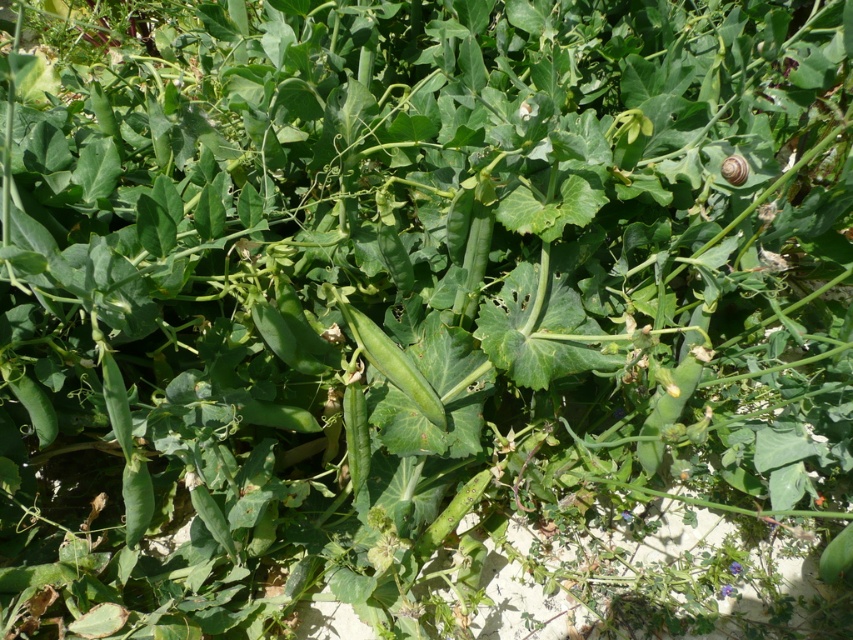
Is green matte pod at center shorter than satin brown snail at upper right?

No, green matte pod at center is not shorter than satin brown snail at upper right.

Does green matte pod at center have a lesser width compared to satin brown snail at upper right?

No, green matte pod at center is not thinner than satin brown snail at upper right.

Between point (386, 348) and point (727, 160), which one is positioned in front?

Positioned in front is point (727, 160).

You are a GUI agent. You are given a task and a screenshot of the screen. Output one action in this format:
    pyautogui.click(x=<x>, y=<y>)
    Task: Click on the green matte pod at center
    The width and height of the screenshot is (853, 640).
    Given the screenshot: What is the action you would take?
    pyautogui.click(x=393, y=364)